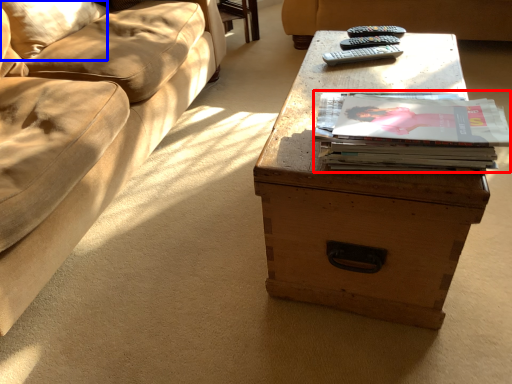
Question: Which object is closer to the camera taking this photo, paperback book (highlighted by a red box) or pillow (highlighted by a blue box)?

Choices:
 (A) paperback book
 (B) pillow

Answer: (A)